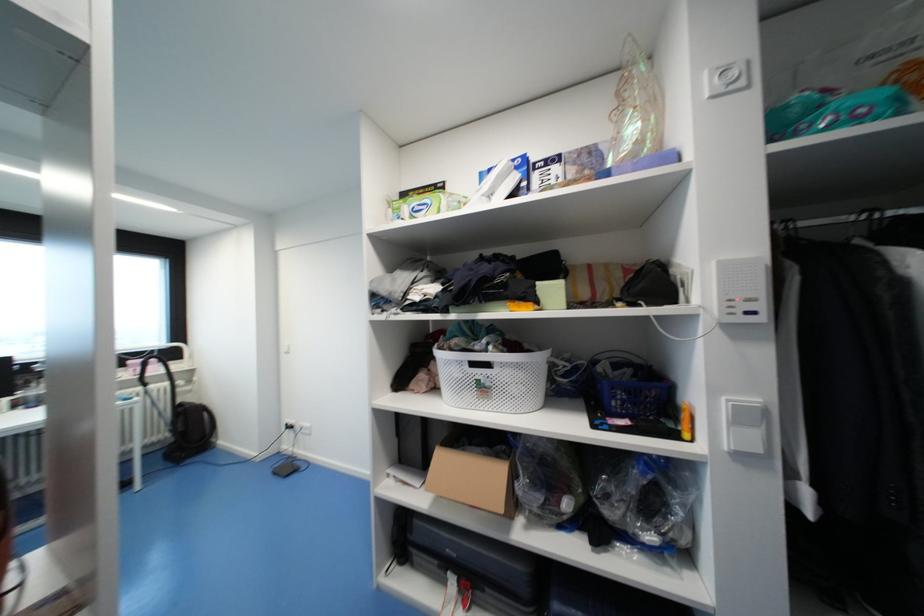
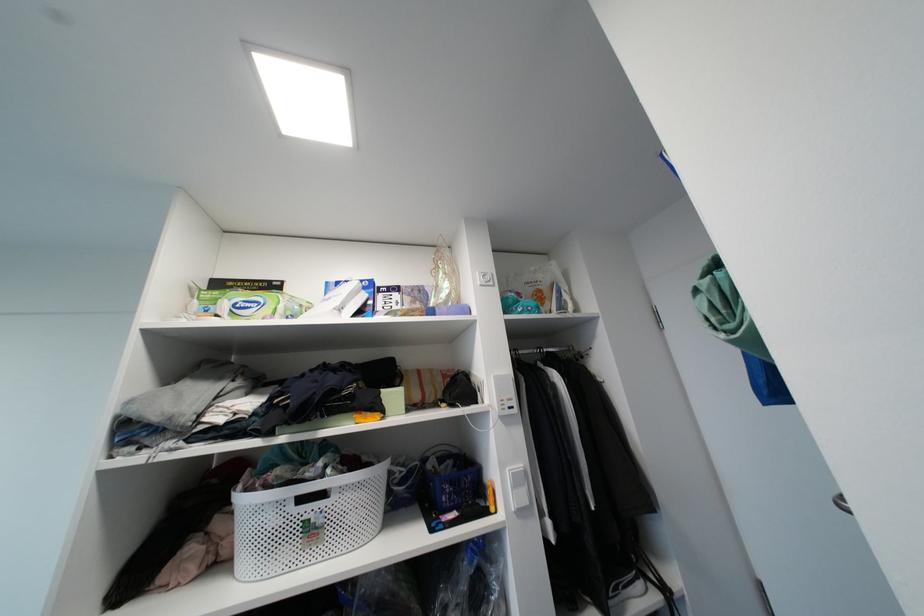
Locate, in the second image, the point that corresponds to (736,305) in the first image.

(506, 403)